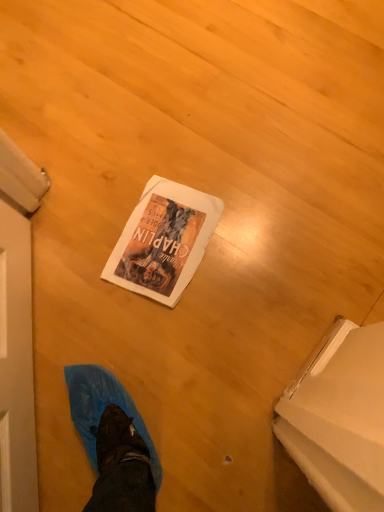
Identify the location of vacant area on top of white paper comic book at center (from a real-world perspective). (165, 239).